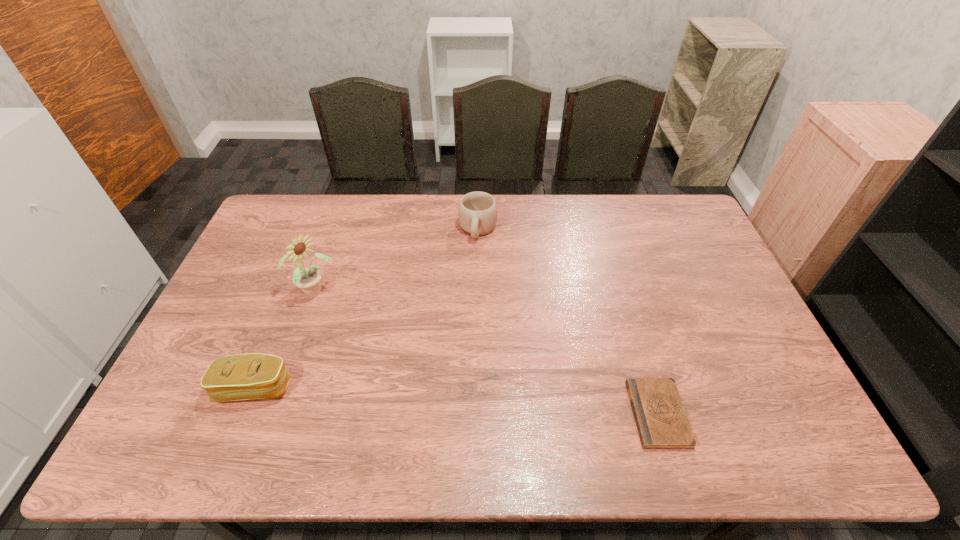
The width and height of the screenshot is (960, 540). I want to click on free space located 0.340m on the front-facing side of the tallest object, so [x=411, y=358].

At what (x,y) coordinates should I click in order to perform the action: click on vacant point located 0.320m on the front-facing side of the tallest object. Please return your answer as a coordinate pair (x, y). The image size is (960, 540). Looking at the image, I should click on (406, 354).

Image resolution: width=960 pixels, height=540 pixels. I want to click on free space located 0.220m on the front-facing side of the tallest object, so click(380, 336).

This screenshot has height=540, width=960. I want to click on vacant position located on the side of the third object from left to right with the handle, so click(x=463, y=311).

In order to click on blank space located 0.340m on the side of the third object from left to right with the handle in this screenshot , I will do `click(461, 322)`.

Identify the location of free location located on the side of the third object from left to right with the handle. (466, 299).

Where is `object that is positioned at the far edge`? This screenshot has width=960, height=540. object that is positioned at the far edge is located at coordinates (477, 212).

You are a GUI agent. You are given a task and a screenshot of the screen. Output one action in this format:
    pyautogui.click(x=<x>, y=<y>)
    Task: Click on the clutch bag located in the near edge section of the desktop
    
    Given the screenshot: What is the action you would take?
    (x=249, y=376)

The image size is (960, 540). I want to click on diary that is at the near edge, so click(661, 420).

Where is `object that is positioned at the left edge`? The height and width of the screenshot is (540, 960). object that is positioned at the left edge is located at coordinates (249, 376).